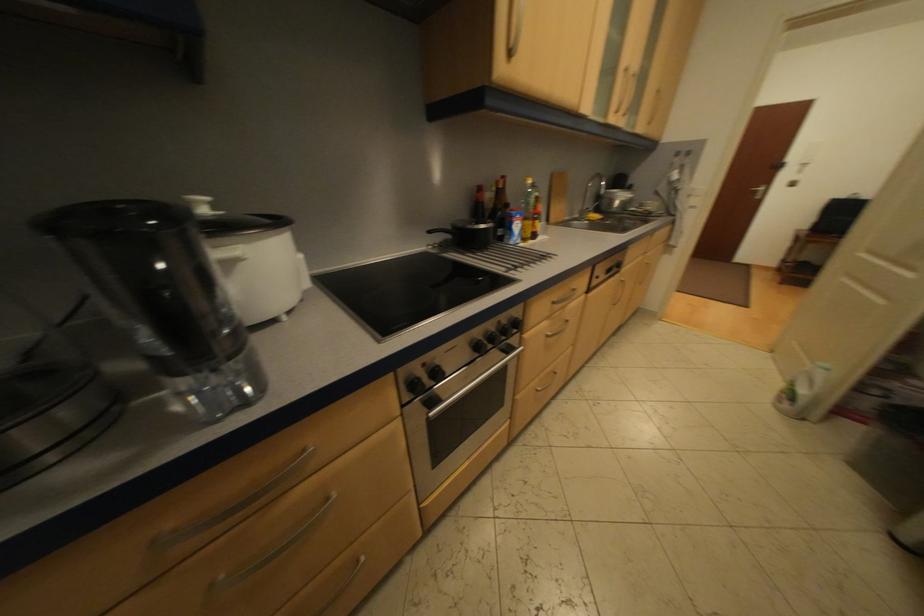
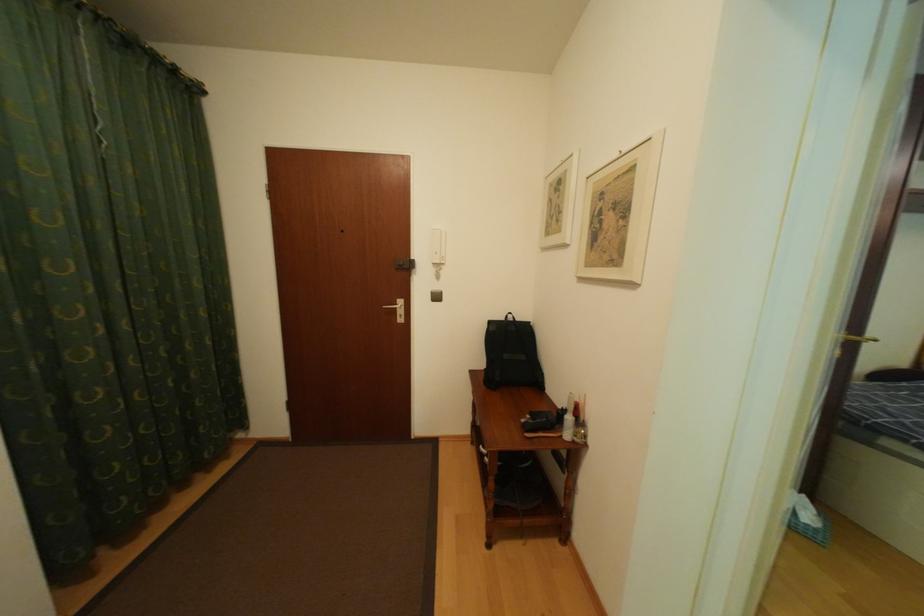
The point at [810,232] is marked in the first image. Where is the corresponding point in the second image?

(484, 374)